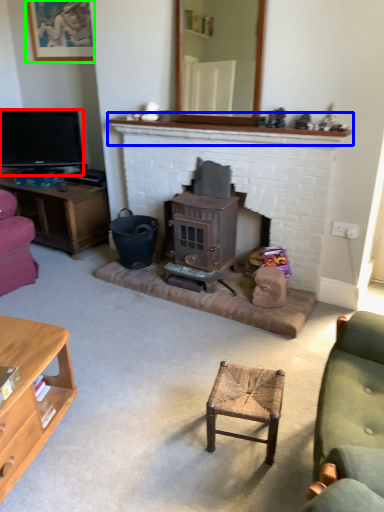
Question: Considering the real-world distances, which object is farthest from television (highlighted by a red box)? mantle (highlighted by a blue box) or picture frame (highlighted by a green box)?

Choices:
 (A) mantle
 (B) picture frame

Answer: (A)